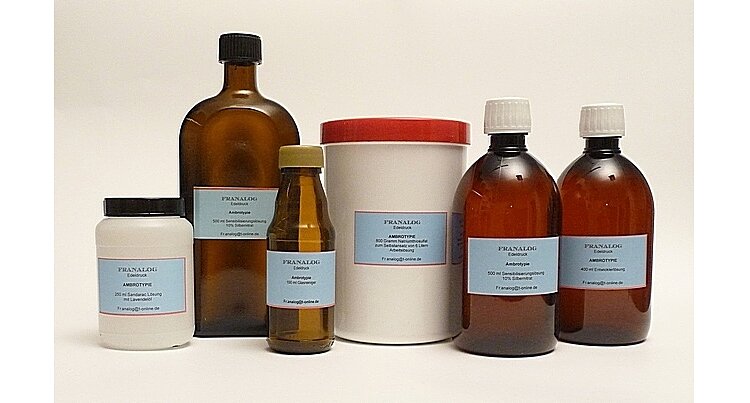
Identify the location of glass bottle. (300, 201).